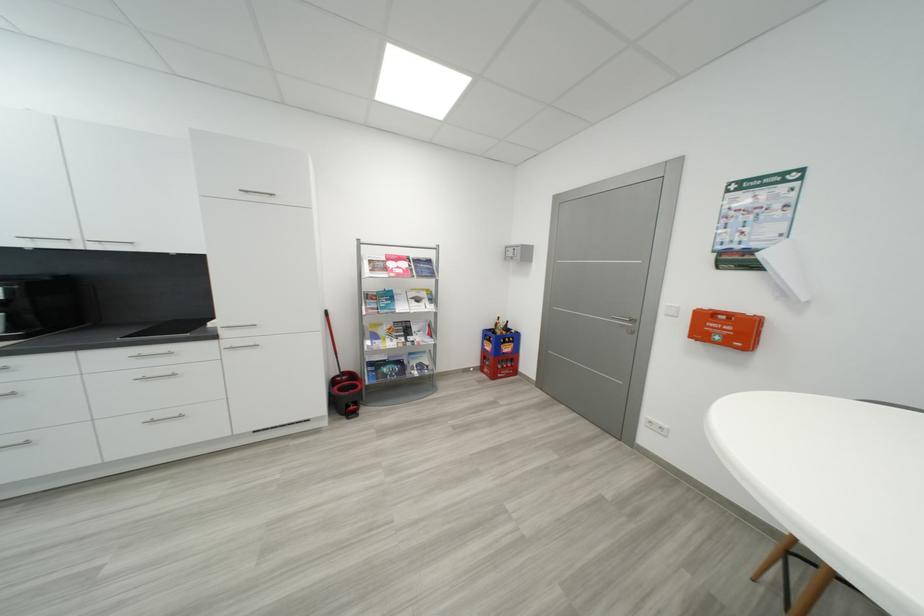
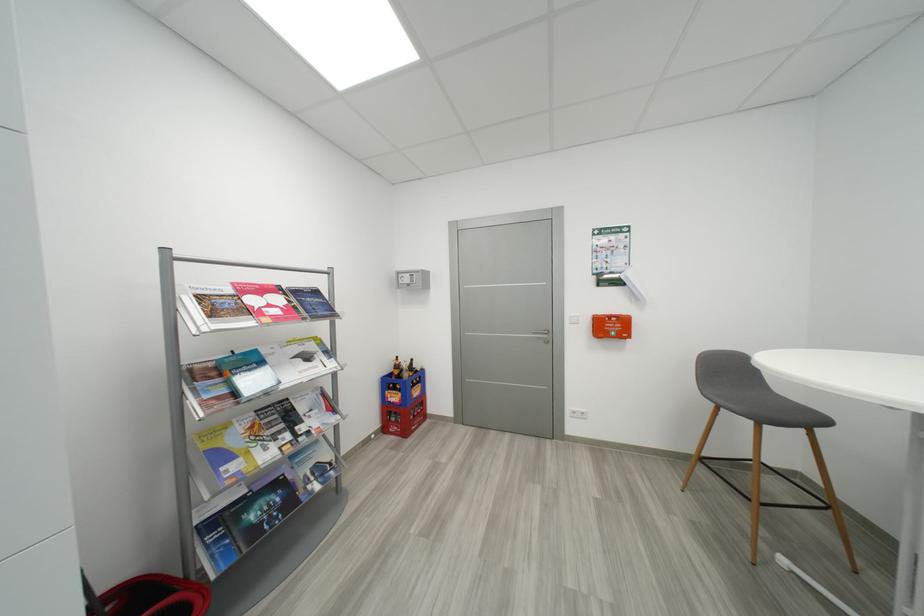
In the second image, find the point that corresponds to [733,333] in the first image.

(617, 330)